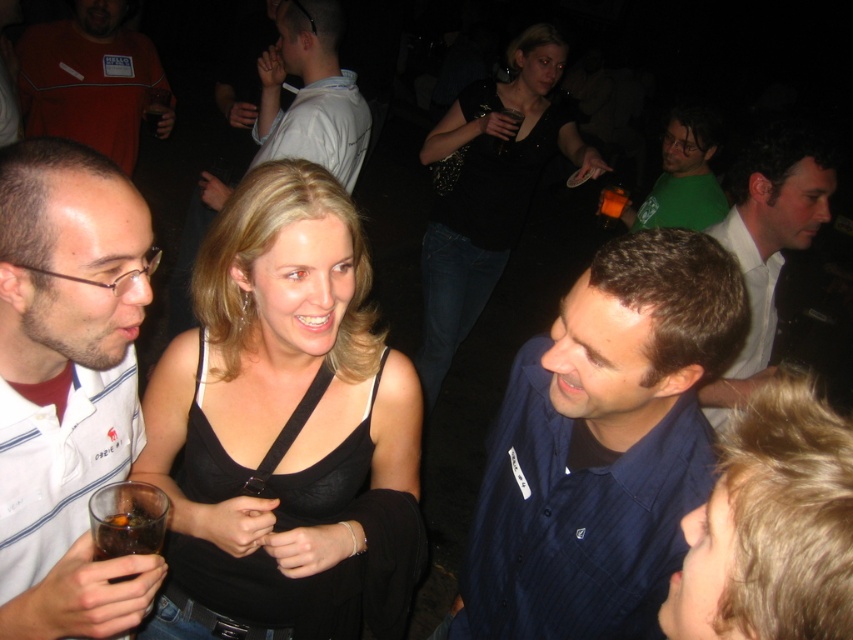
Question: Does white striped polo shirt at left come in front of brown liquid glass at lower left?

Choices:
 (A) yes
 (B) no

Answer: (A)

Question: Is black matte tank top at center below brown liquid glass at lower left?

Choices:
 (A) no
 (B) yes

Answer: (A)

Question: Can you confirm if black matte tank top at center is smaller than white shirt at right?

Choices:
 (A) no
 (B) yes

Answer: (B)

Question: Which object is closer to the camera taking this photo?

Choices:
 (A) green matte shirt at upper right
 (B) black satin dress at center
 (C) white shirt at upper center
 (D) brown liquid glass at lower left

Answer: (D)

Question: Which of these objects is positioned farthest from the green matte shirt at upper right?

Choices:
 (A) orange fleece jacket at upper left
 (B) white shirt at upper center

Answer: (A)

Question: Which object is farther from the camera taking this photo?

Choices:
 (A) dark blue striped shirt at center
 (B) green matte shirt at upper right
 (C) white shirt at upper center
 (D) black fabric dress at center

Answer: (B)